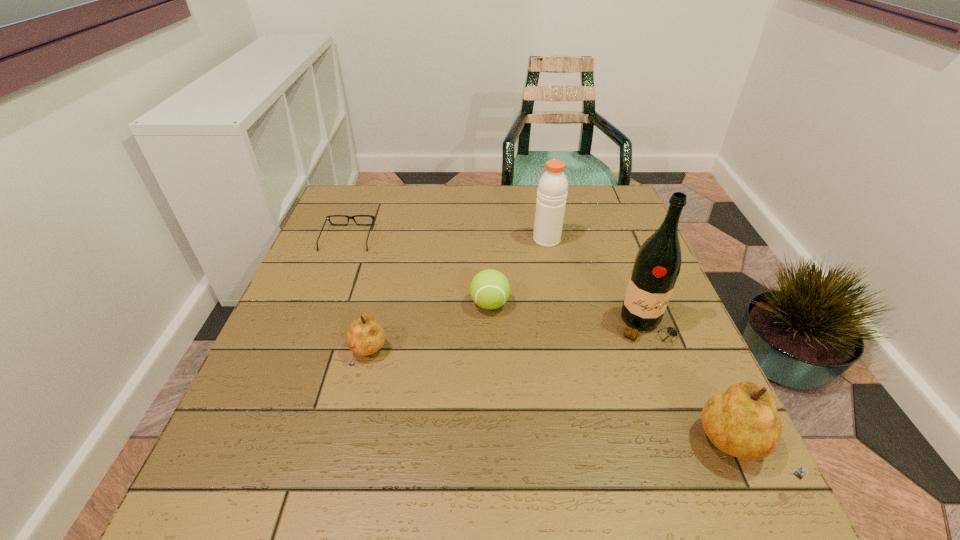
Identify the location of object that is at the left edge. Image resolution: width=960 pixels, height=540 pixels. (328, 217).

The height and width of the screenshot is (540, 960). In order to click on pear that is at the right edge in this screenshot , I will do `click(742, 421)`.

Where is `wine bottle located in the right edge section of the desktop`? The width and height of the screenshot is (960, 540). wine bottle located in the right edge section of the desktop is located at coordinates [657, 264].

Identify the location of object at the far left corner. The height and width of the screenshot is (540, 960). (328, 217).

The image size is (960, 540). What are the coordinates of `object that is at the near right corner` in the screenshot? It's located at (742, 421).

At what (x,y) coordinates should I click in order to perform the action: click on vacant region at the far edge of the desktop. Please return your answer as a coordinate pair (x, y). Looking at the image, I should click on (404, 203).

I want to click on vacant space at the near edge of the desktop, so click(x=571, y=426).

Image resolution: width=960 pixels, height=540 pixels. In the image, there is a desktop. Find the location of `vacant region at the left edge`. vacant region at the left edge is located at coordinates (322, 235).

Locate an element on the screen. vacant space at the right edge is located at coordinates (681, 321).

This screenshot has width=960, height=540. I want to click on free location at the near left corner of the desktop, so point(221,454).